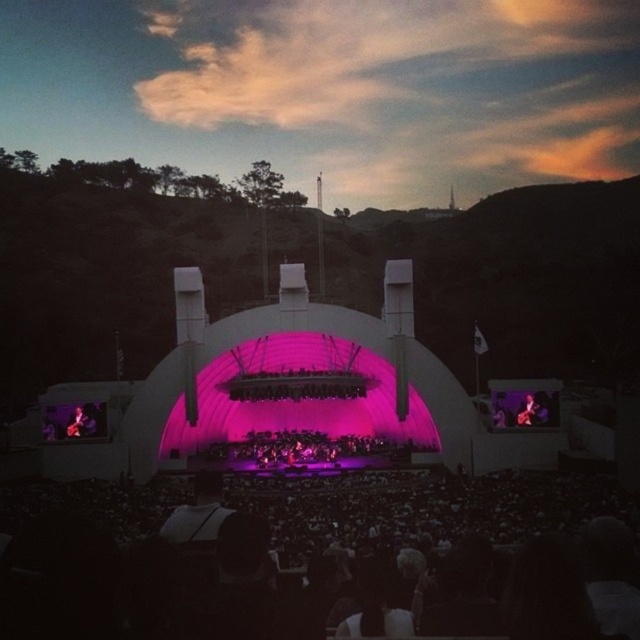
You are a photographer at the concert and want to capture a photo of both the shiny purple dress at center and the matte black guitar at center in the same frame. Which object should you focus on first if you want to ensure both are in focus?

The shiny purple dress at center is positioned on the left side of matte black guitar at center. To ensure both are in focus, you should focus on the matte black guitar at center since it is farther away from the camera than the shiny purple dress at center.

You are a photographer standing in the audience at the concert. You want to take a photo of the stage. There are two points marked in the image. One is at coordinate point (x=632, y=522) and the other at point (x=355, y=458). Which point is closer to your camera position?

Point (x=632, y=522) is closer to the camera than point (x=355, y=458).

You are a photographer at the concert and want to capture a closeup of the shiny purple dress at center. The concert hall has a stage with two large screens on either side. Which screen should you stand in front of to ensure the dress is visible on the screen?

The shiny purple dress at center is located at point (317, 448). Since the screens are positioned on either side of the stage, you should stand in front of the screen that corresponds to the dress location. However, without specific screen coordinates, it is safest to assume the dress would be visible on both screens as they flank the stage.